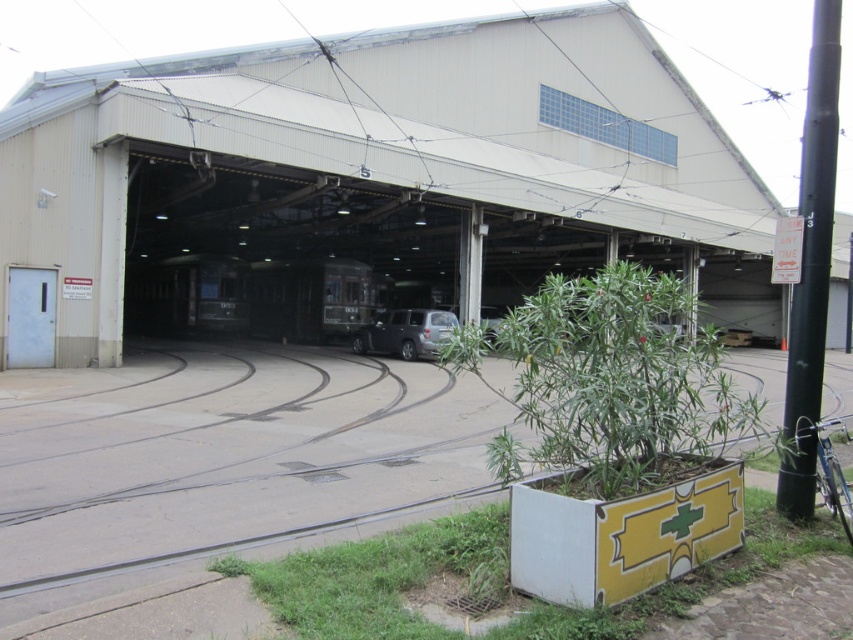
Question: Does black metal pole at right appear on the left side of satin black suv at center?

Choices:
 (A) yes
 (B) no

Answer: (B)

Question: Is black metal pole at right closer to camera compared to satin black suv at center?

Choices:
 (A) yes
 (B) no

Answer: (A)

Question: Among these objects, which one is farthest from the camera?

Choices:
 (A) satin black suv at center
 (B) black metal pole at right

Answer: (A)

Question: Can you confirm if black metal pole at right is bigger than satin black suv at center?

Choices:
 (A) no
 (B) yes

Answer: (B)

Question: Which point is closer to the camera taking this photo?

Choices:
 (A) (363, 326)
 (B) (795, 506)

Answer: (B)